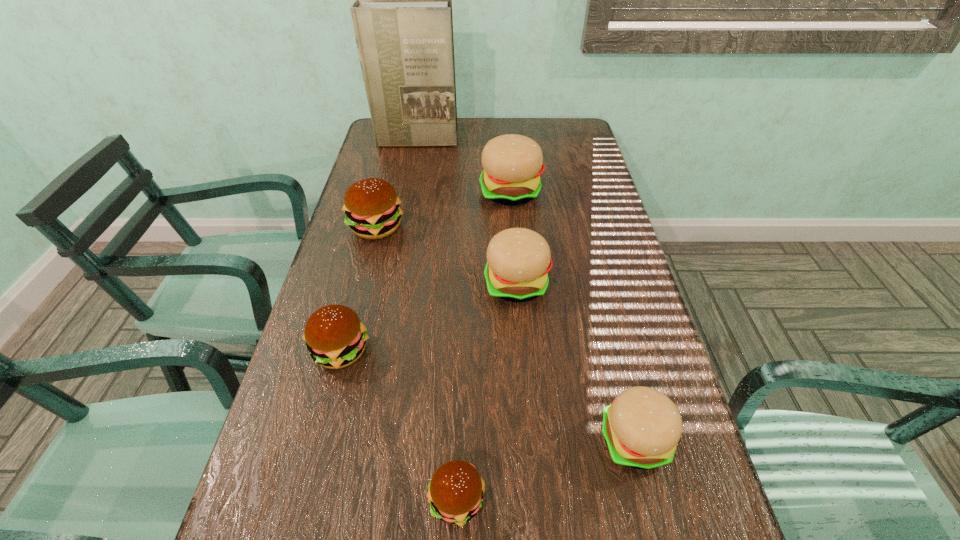
Locate an element on the screen. This screenshot has height=540, width=960. vacant region between the shortest hamburger and the fourth farthest hamburger is located at coordinates (398, 425).

Where is `vacant region between the second farthest brown hamburger and the fourth nearest object`? This screenshot has height=540, width=960. vacant region between the second farthest brown hamburger and the fourth nearest object is located at coordinates (429, 317).

The height and width of the screenshot is (540, 960). I want to click on vacant space in between the second biggest beige hamburger and the second nearest brown hamburger, so click(429, 317).

Identify which object is located as the third nearest to the second biggest beige hamburger. Please provide its 2D coordinates. Your answer should be formatted as a tuple, i.e. [(x, y)], where the tuple contains the x and y coordinates of a point satisfying the conditions above.

[(335, 337)]

Locate which object is the third closest to the phonebook. Please provide its 2D coordinates. Your answer should be formatted as a tuple, i.e. [(x, y)], where the tuple contains the x and y coordinates of a point satisfying the conditions above.

[(518, 260)]

This screenshot has height=540, width=960. In order to click on hamburger object that ranks as the second closest to the phonebook in this screenshot , I will do `click(371, 205)`.

Where is `the third closest hamburger relative to the shortest hamburger`? The height and width of the screenshot is (540, 960). the third closest hamburger relative to the shortest hamburger is located at coordinates (518, 260).

This screenshot has width=960, height=540. I want to click on beige hamburger that stands as the closest to the rightmost brown hamburger, so click(x=641, y=428).

Select which beige hamburger is the second closest to the third nearest object. Please provide its 2D coordinates. Your answer should be formatted as a tuple, i.e. [(x, y)], where the tuple contains the x and y coordinates of a point satisfying the conditions above.

[(641, 428)]

At what (x,y) coordinates should I click in order to perform the action: click on the third closest brown hamburger to the rightmost hamburger. Please return your answer as a coordinate pair (x, y). The image size is (960, 540). Looking at the image, I should click on (371, 205).